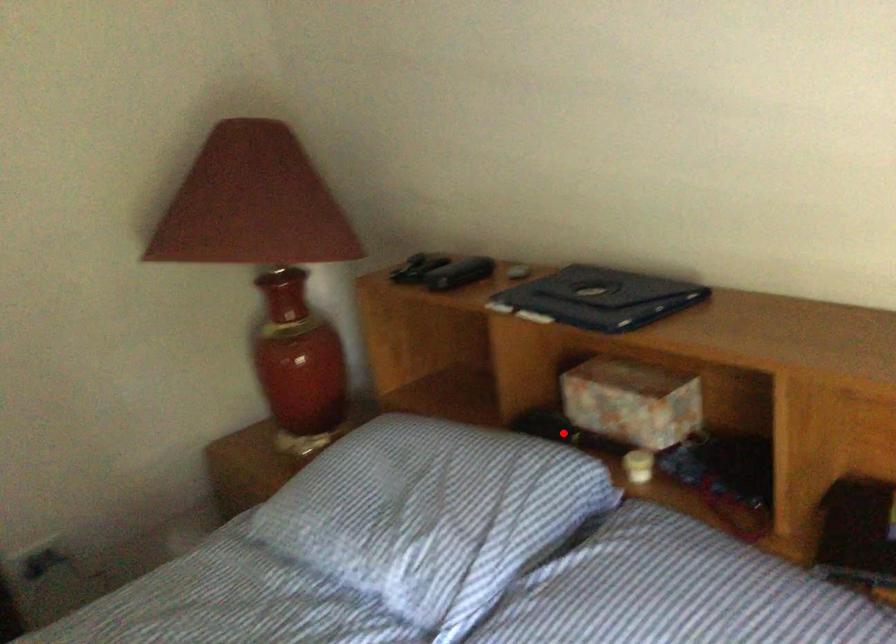
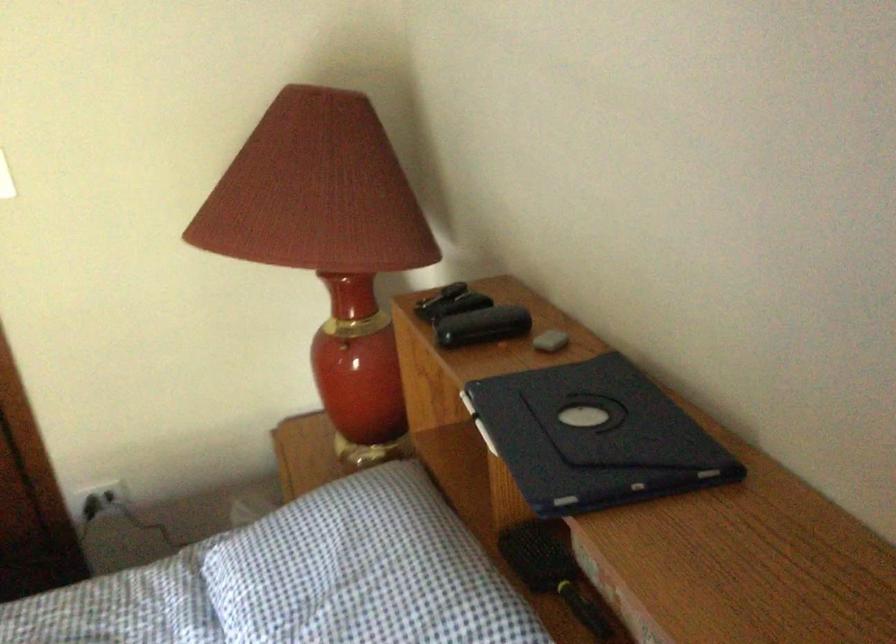
Question: I am providing you with two images of the same scene from different viewpoints. In image1, a red point is highlighted. Considering the same 3D point in image2, which of the following is correct?

Choices:
 (A) It is closer
 (B) It is farther

Answer: (A)